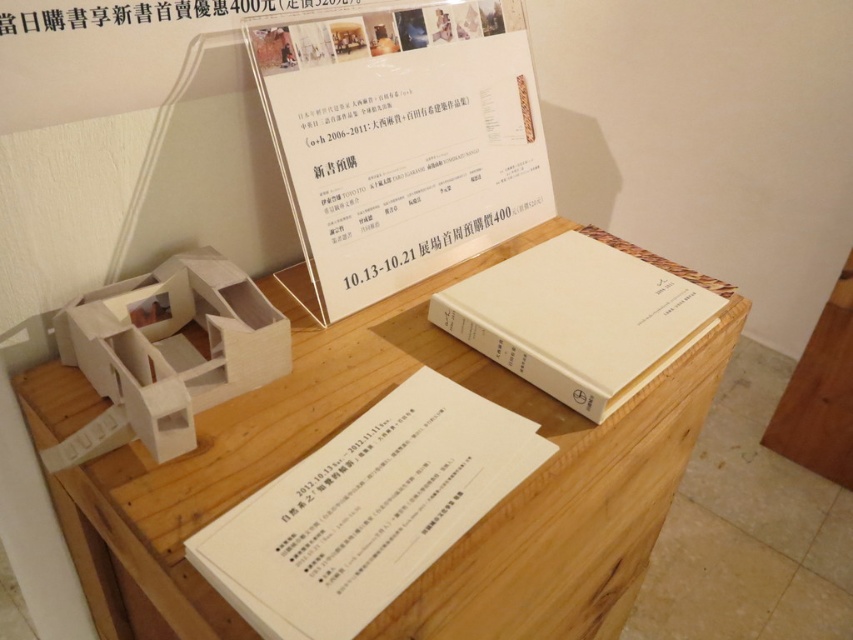
Question: Does white cardboard model at center appear under white matte book at center?

Choices:
 (A) yes
 (B) no

Answer: (A)

Question: In this image, where is wooden table at center located relative to white cardboard model at center?

Choices:
 (A) left
 (B) right

Answer: (B)

Question: Among these points, which one is farthest from the camera?

Choices:
 (A) (337, 376)
 (B) (169, 266)

Answer: (B)

Question: Which point is closer to the camera?

Choices:
 (A) white matte book at center
 (B) white cardboard model at center

Answer: (B)

Question: Estimate the real-world distances between objects in this image. Which object is farther from the white matte book at center?

Choices:
 (A) white cardboard model at center
 (B) wooden table at center

Answer: (A)

Question: Does white cardboard model at center have a smaller size compared to white matte book at center?

Choices:
 (A) no
 (B) yes

Answer: (B)